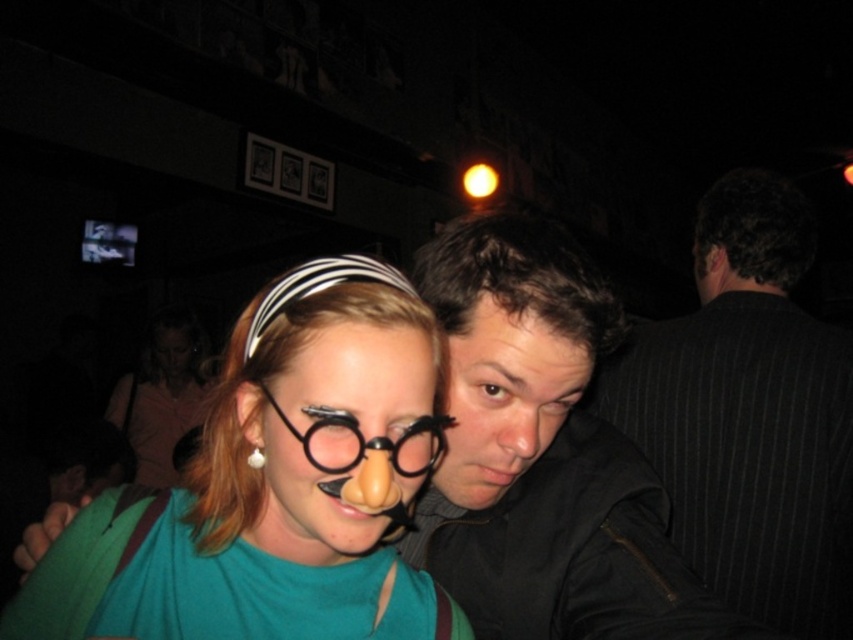
You are at a social gathering and want to move from the green top person to the dark jacket person. Which direction should you move relative to the point at (370, 339) and the point at (349, 442)?

Since point (370, 339) is in front of point (349, 442), you should move towards the point at (349, 442) to reach the dark jacket person from the green top person.

You are a photographer trying to capture a candid shot of the two people in the foreground. You notice the green matte shirt at center and the matte black glasses at center. Which object should you focus on first to ensure both are in sharp focus?

The green matte shirt at center is closer to the viewer than the matte black glasses at center. To ensure both are in sharp focus, you should focus on the green matte shirt at center first, as it is the closer object, and adjust the depth of field accordingly.